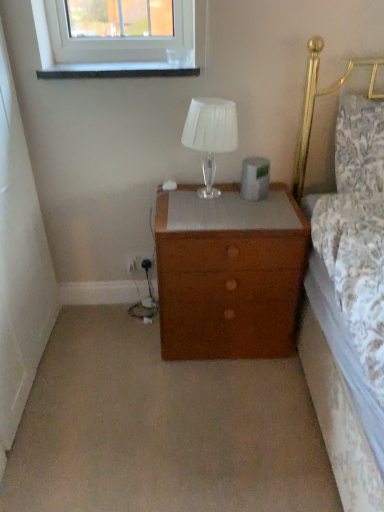
Question: Is floral fabric pillow at right smaller than wooden nightstand at center?

Choices:
 (A) yes
 (B) no

Answer: (A)

Question: Is floral fabric pillow at right at the left side of wooden nightstand at center?

Choices:
 (A) yes
 (B) no

Answer: (B)

Question: Does floral fabric pillow at right appear on the right side of wooden nightstand at center?

Choices:
 (A) yes
 (B) no

Answer: (A)

Question: From the image's perspective, is floral fabric pillow at right located above wooden nightstand at center?

Choices:
 (A) no
 (B) yes

Answer: (B)

Question: Is floral fabric pillow at right next to wooden nightstand at center and touching it?

Choices:
 (A) no
 (B) yes

Answer: (A)

Question: Is point coord(284,325) positioned closer to the camera than point coord(374,175)?

Choices:
 (A) closer
 (B) farther

Answer: (B)

Question: Is wooden nightstand at center inside the boundaries of floral fabric pillow at right, or outside?

Choices:
 (A) inside
 (B) outside

Answer: (B)

Question: From the image's perspective, is wooden nightstand at center above or below floral fabric pillow at right?

Choices:
 (A) below
 (B) above

Answer: (A)

Question: In terms of width, does wooden nightstand at center look wider or thinner when compared to floral fabric pillow at right?

Choices:
 (A) wide
 (B) thin

Answer: (A)

Question: Does point (210, 129) appear closer or farther from the camera than point (340, 147)?

Choices:
 (A) closer
 (B) farther

Answer: (A)

Question: From their relative heights in the image, would you say translucent glass table lamp at upper center is taller or shorter than floral fabric pillow at right?

Choices:
 (A) short
 (B) tall

Answer: (A)

Question: Is translucent glass table lamp at upper center situated inside floral fabric pillow at right or outside?

Choices:
 (A) inside
 (B) outside

Answer: (B)

Question: In the image, is translucent glass table lamp at upper center on the left side or the right side of floral fabric pillow at right?

Choices:
 (A) right
 (B) left

Answer: (B)

Question: From a real-world perspective, is floral fabric pillow at right physically located above or below wooden nightstand at center?

Choices:
 (A) above
 (B) below

Answer: (A)

Question: In the image, is floral fabric pillow at right on the left side or the right side of wooden nightstand at center?

Choices:
 (A) left
 (B) right

Answer: (B)